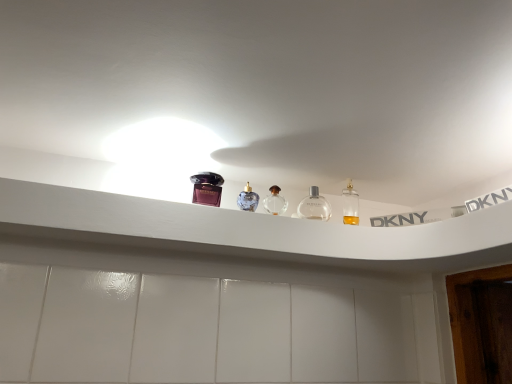
Describe the element at coordinates (314, 206) in the screenshot. The image size is (512, 384). I see `clear glass bottle at center, which is the 1th bottle from right to left` at that location.

Image resolution: width=512 pixels, height=384 pixels. Describe the element at coordinates (252, 231) in the screenshot. I see `white plastic shelf at upper center` at that location.

Find the location of `clear glass bottle at center, which is the 1th bottle from right to left`. clear glass bottle at center, which is the 1th bottle from right to left is located at coordinates (314, 206).

From the image's perspective, is white plastic shelf at upper center located above matte purple perfume at upper center?

Incorrect, from the image's perspective, white plastic shelf at upper center is lower than matte purple perfume at upper center.

Can we say white plastic shelf at upper center lies outside matte purple perfume at upper center?

Yes, white plastic shelf at upper center is outside of matte purple perfume at upper center.

Does point (272, 225) come behind point (216, 185)?

No, it is in front of (216, 185).

Between matte purple perfume at upper center and clear glass perfume at center, which is counted as the second bottle, starting from the right, which one has larger width?

matte purple perfume at upper center.

Would you say matte purple perfume at upper center is a long distance from clear glass perfume at center, which is counted as the second bottle, starting from the right?

No, there isn't a large distance between matte purple perfume at upper center and clear glass perfume at center, which is counted as the second bottle, starting from the right.

From a real-world perspective, is matte purple perfume at upper center positioned under clear glass perfume at center, the 1th bottle from the left, based on gravity?

No.

Is matte purple perfume at upper center oriented towards clear glass perfume at center, the 1th bottle from the left?

No, matte purple perfume at upper center is not facing towards clear glass perfume at center, the 1th bottle from the left.

Which of these two, clear glass bottle at center, acting as the 2th bottle starting from the left, or white plastic shelf at upper center, stands taller?

With more height is clear glass bottle at center, acting as the 2th bottle starting from the left.

From the image's perspective, who appears lower, clear glass bottle at center, acting as the 2th bottle starting from the left, or white plastic shelf at upper center?

white plastic shelf at upper center appears lower in the image.

Based on their positions, is clear glass bottle at center, acting as the 2th bottle starting from the left, located to the left or right of white plastic shelf at upper center?

Clearly, clear glass bottle at center, acting as the 2th bottle starting from the left, is on the right of white plastic shelf at upper center in the image.

Looking at their sizes, would you say clear glass bottle at center, which is the 1th bottle from right to left, is wider or thinner than clear glass perfume at center, which is counted as the second bottle, starting from the right?

In the image, clear glass bottle at center, which is the 1th bottle from right to left, appears to be wider than clear glass perfume at center, which is counted as the second bottle, starting from the right.

Can you confirm if clear glass bottle at center, acting as the 2th bottle starting from the left, is shorter than clear glass perfume at center, the 1th bottle from the left?

In fact, clear glass bottle at center, acting as the 2th bottle starting from the left, may be taller than clear glass perfume at center, the 1th bottle from the left.

Where is `bottle above the clear glass bottle at center, acting as the 2th bottle starting from the left (from the image's perspective)`? This screenshot has width=512, height=384. bottle above the clear glass bottle at center, acting as the 2th bottle starting from the left (from the image's perspective) is located at coordinates (275, 201).

Which of these two, clear glass perfume at center, which is counted as the second bottle, starting from the right, or clear glass bottle at center, which is the 1th bottle from right to left, is wider?

clear glass bottle at center, which is the 1th bottle from right to left.

Is clear glass perfume at center, which is counted as the second bottle, starting from the right, far away from clear glass bottle at center, which is the 1th bottle from right to left?

They are positioned close to each other.

Considering the sizes of clear glass perfume at center, which is counted as the second bottle, starting from the right, and white plastic shelf at upper center in the image, is clear glass perfume at center, which is counted as the second bottle, starting from the right, bigger or smaller than white plastic shelf at upper center?

Considering their sizes, clear glass perfume at center, which is counted as the second bottle, starting from the right, takes up less space than white plastic shelf at upper center.

Can you see clear glass perfume at center, which is counted as the second bottle, starting from the right, touching white plastic shelf at upper center?

They are not placed beside each other.

From a real-world perspective, who is located higher, clear glass perfume at center, the 1th bottle from the left, or white plastic shelf at upper center?

clear glass perfume at center, the 1th bottle from the left.

From the image's perspective, is clear glass perfume at center, which is counted as the second bottle, starting from the right, located above or below white plastic shelf at upper center?

Based on their image positions, clear glass perfume at center, which is counted as the second bottle, starting from the right, is located above white plastic shelf at upper center.

From a real-world perspective, is matte purple perfume at upper center physically below white plastic shelf at upper center?

No, from a real-world perspective, matte purple perfume at upper center is not below white plastic shelf at upper center.

Is matte purple perfume at upper center completely or partially outside of white plastic shelf at upper center?

Yes, matte purple perfume at upper center is not within white plastic shelf at upper center.

Does matte purple perfume at upper center have a greater width compared to white plastic shelf at upper center?

In fact, matte purple perfume at upper center might be narrower than white plastic shelf at upper center.

Is matte purple perfume at upper center looking in the opposite direction of white plastic shelf at upper center?

No, matte purple perfume at upper center is not facing away from white plastic shelf at upper center.

Identify the location of toiletry that is above the white plastic shelf at upper center (from a real-world perspective). The width and height of the screenshot is (512, 384). tap(207, 188).

Locate an element on the screen. toiletry located above the clear glass perfume at center, which is counted as the second bottle, starting from the right (from the image's perspective) is located at coordinates (207, 188).

From the image, which object appears to be farther from clear glass perfume at center, which is counted as the second bottle, starting from the right, clear glass bottle at center, which is the 1th bottle from right to left, or matte purple perfume at upper center?

The object further to clear glass perfume at center, which is counted as the second bottle, starting from the right, is matte purple perfume at upper center.

When comparing their distances from clear glass perfume at center, the 1th bottle from the left, does clear glass bottle at center, acting as the 2th bottle starting from the left, or white plastic shelf at upper center seem further?

white plastic shelf at upper center.

From the image, which object appears to be nearer to clear glass bottle at center, which is the 1th bottle from right to left, white plastic shelf at upper center or matte purple perfume at upper center?

matte purple perfume at upper center is positioned closer to the anchor clear glass bottle at center, which is the 1th bottle from right to left.

Considering their positions, is matte purple perfume at upper center positioned further to white plastic shelf at upper center than clear glass perfume at center, which is counted as the second bottle, starting from the right?

Based on the image, clear glass perfume at center, which is counted as the second bottle, starting from the right, appears to be further to white plastic shelf at upper center.

Estimate the real-world distances between objects in this image. Which object is closer to clear glass perfume at center, the 1th bottle from the left, white plastic shelf at upper center or clear glass bottle at center, acting as the 2th bottle starting from the left?

clear glass bottle at center, acting as the 2th bottle starting from the left.

Looking at the image, which one is located closer to clear glass perfume at center, the 1th bottle from the left, matte purple perfume at upper center or white plastic shelf at upper center?

Among the two, matte purple perfume at upper center is located nearer to clear glass perfume at center, the 1th bottle from the left.

Based on the photo, looking at the image, which one is located further to white plastic shelf at upper center, clear glass bottle at center, acting as the 2th bottle starting from the left, or matte purple perfume at upper center?

clear glass bottle at center, acting as the 2th bottle starting from the left, is positioned further to the anchor white plastic shelf at upper center.

Which object lies further to the anchor point matte purple perfume at upper center, clear glass perfume at center, the 1th bottle from the left, or clear glass bottle at center, acting as the 2th bottle starting from the left?

The object further to matte purple perfume at upper center is clear glass bottle at center, acting as the 2th bottle starting from the left.

At what (x,y) coordinates should I click in order to perform the action: click on bottle between matte purple perfume at upper center and clear glass bottle at center, acting as the 2th bottle starting from the left, from left to right. Please return your answer as a coordinate pair (x, y). This screenshot has width=512, height=384. Looking at the image, I should click on (275, 201).

Locate an element on the screen. toiletry between white plastic shelf at upper center and clear glass perfume at center, which is counted as the second bottle, starting from the right, in the front-back direction is located at coordinates (207, 188).

The width and height of the screenshot is (512, 384). Identify the location of bottle between white plastic shelf at upper center and clear glass bottle at center, acting as the 2th bottle starting from the left, from front to back. (275, 201).

Image resolution: width=512 pixels, height=384 pixels. In order to click on toiletry positioned between white plastic shelf at upper center and clear glass bottle at center, which is the 1th bottle from right to left, from near to far in this screenshot , I will do `click(207, 188)`.